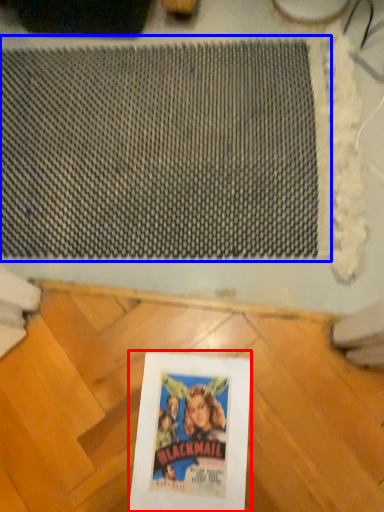
Question: Which of the following is the closest to the observer, picture frame (highlighted by a red box) or mat (highlighted by a blue box)?

Choices:
 (A) picture frame
 (B) mat

Answer: (A)